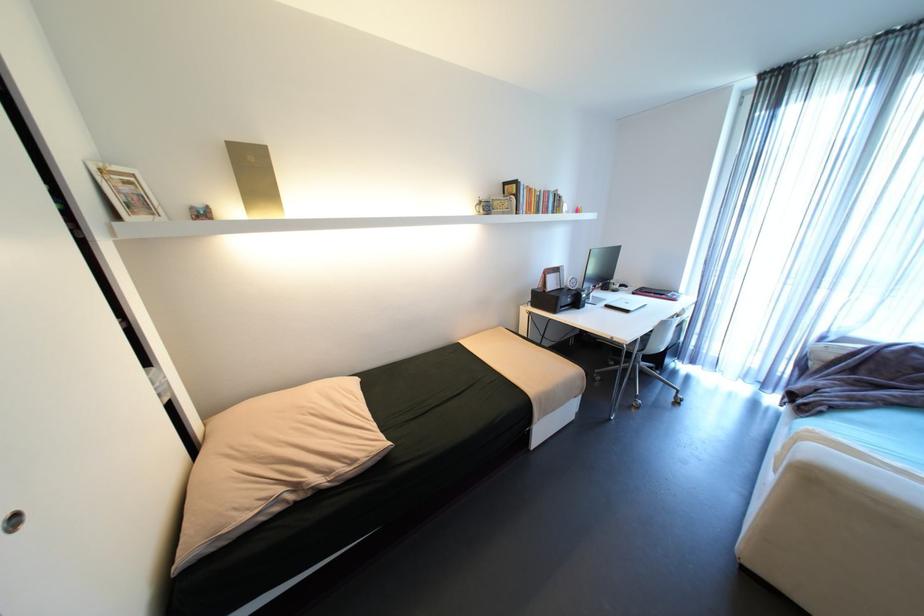
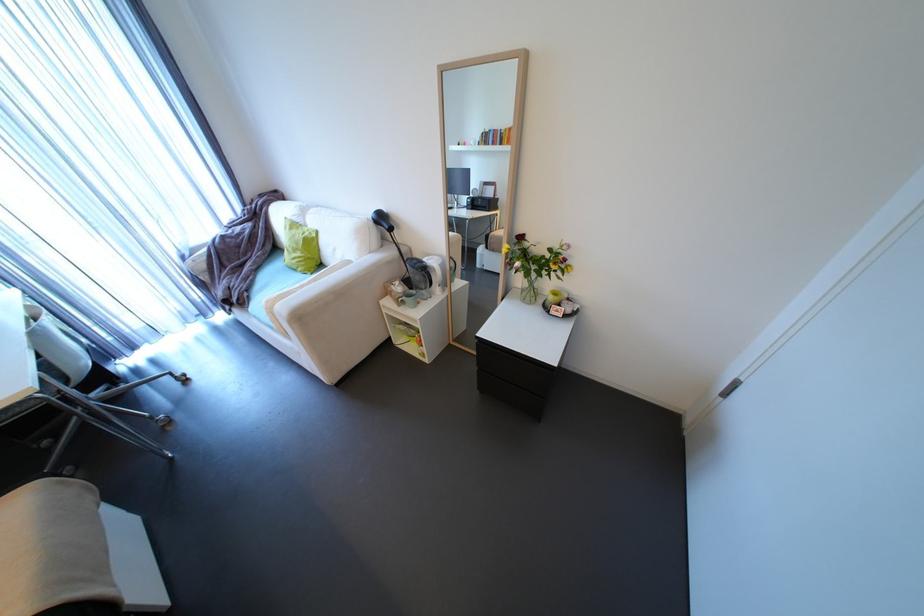
The point at (621, 339) is marked in the first image. Where is the corresponding point in the second image?

(7, 408)